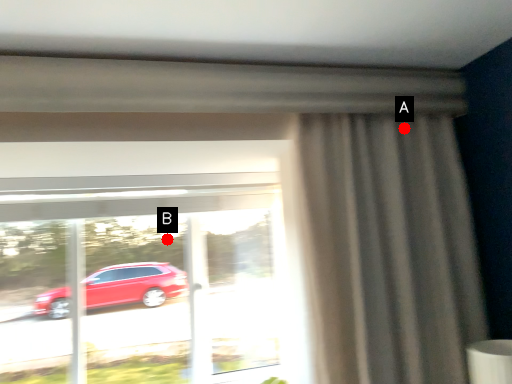
Question: Two points are circled on the image, labeled by A and B beside each circle. Which of the following is the farthest from the observer?

Choices:
 (A) A is further
 (B) B is further

Answer: (B)